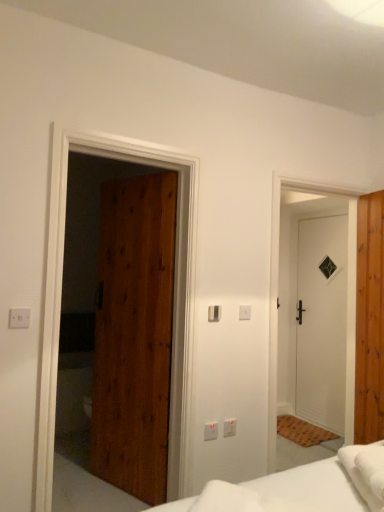
Question: Considering the relative sizes of satin silver switch at center, which is counted as the second light switch, starting from the front, and white plastic electric outlet at center, placed as the first electric outlet when sorted from right to left, in the image provided, is satin silver switch at center, which is counted as the second light switch, starting from the front, wider than white plastic electric outlet at center, placed as the first electric outlet when sorted from right to left,?

Choices:
 (A) no
 (B) yes

Answer: (B)

Question: From a real-world perspective, is satin silver switch at center, which is counted as the second light switch, starting from the right, under white plastic electric outlet at center, the first electric outlet ordered from the bottom?

Choices:
 (A) no
 (B) yes

Answer: (A)

Question: Does satin silver switch at center, which is counted as the second light switch, starting from the right, contain white plastic electric outlet at center, arranged as the second electric outlet when viewed from the left?

Choices:
 (A) no
 (B) yes

Answer: (A)

Question: Are satin silver switch at center, which is counted as the second light switch, starting from the front, and white plastic electric outlet at center, arranged as the second electric outlet when viewed from the left, far apart?

Choices:
 (A) yes
 (B) no

Answer: (B)

Question: Is satin silver switch at center, which is counted as the second light switch, starting from the right, bigger than white plastic electric outlet at center, the first electric outlet ordered from the bottom?

Choices:
 (A) yes
 (B) no

Answer: (A)

Question: From a real-world perspective, is satin silver switch at center, the 3th light switch from the bottom, physically above white plastic electric outlet at center, placed as the first electric outlet when sorted from right to left?

Choices:
 (A) no
 (B) yes

Answer: (B)

Question: From a real-world perspective, is white plastic light switch at center, placed as the second light switch when sorted from top to bottom, positioned under satin silver switch at center, the 3th light switch from the bottom, based on gravity?

Choices:
 (A) no
 (B) yes

Answer: (A)

Question: From a real-world perspective, does white plastic light switch at center, which is the 1th light switch from right to left, stand above satin silver switch at center, which is counted as the second light switch, starting from the right?

Choices:
 (A) yes
 (B) no

Answer: (A)

Question: Considering the relative positions of white plastic light switch at center, which is the 1th light switch from right to left, and satin silver switch at center, which is counted as the second light switch, starting from the right, in the image provided, is white plastic light switch at center, which is the 1th light switch from right to left, to the right of satin silver switch at center, which is counted as the second light switch, starting from the right, from the viewer's perspective?

Choices:
 (A) no
 (B) yes

Answer: (B)

Question: Can you confirm if white plastic light switch at center, the second light switch positioned from the bottom, is taller than satin silver switch at center, the 2th light switch when ordered from back to front?

Choices:
 (A) yes
 (B) no

Answer: (A)

Question: From the image's perspective, does white plastic light switch at center, the third light switch viewed from the front, appear higher than satin silver switch at center, which is the second light switch in left-to-right order?

Choices:
 (A) no
 (B) yes

Answer: (A)

Question: Is white plastic light switch at center, which ranks as the 3th light switch in left-to-right order, next to satin silver switch at center, the 3th light switch from the bottom?

Choices:
 (A) no
 (B) yes

Answer: (A)

Question: From the image's perspective, is metallic silver light switch at lower center, the first light switch when ordered from front to back, located beneath white plastic light switch at center, placed as the second light switch when sorted from top to bottom?

Choices:
 (A) yes
 (B) no

Answer: (A)